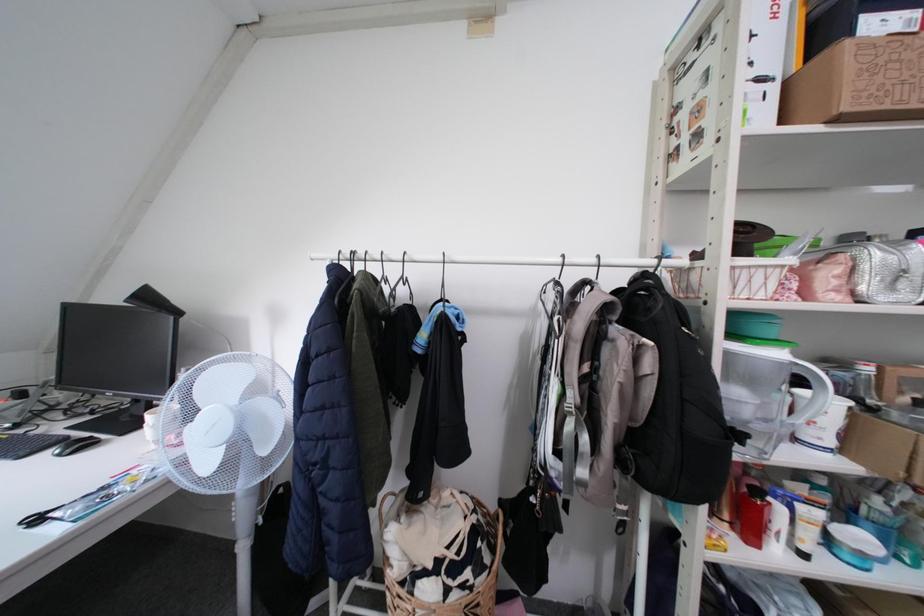
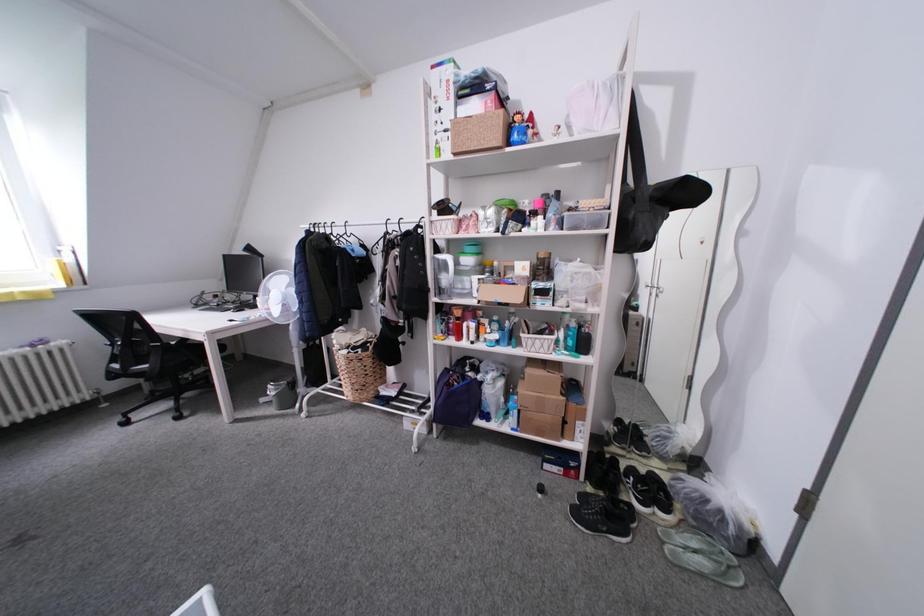
Which direction would the cameraman need to move to produce the second image?

The movement direction of the cameraman is right, backward.